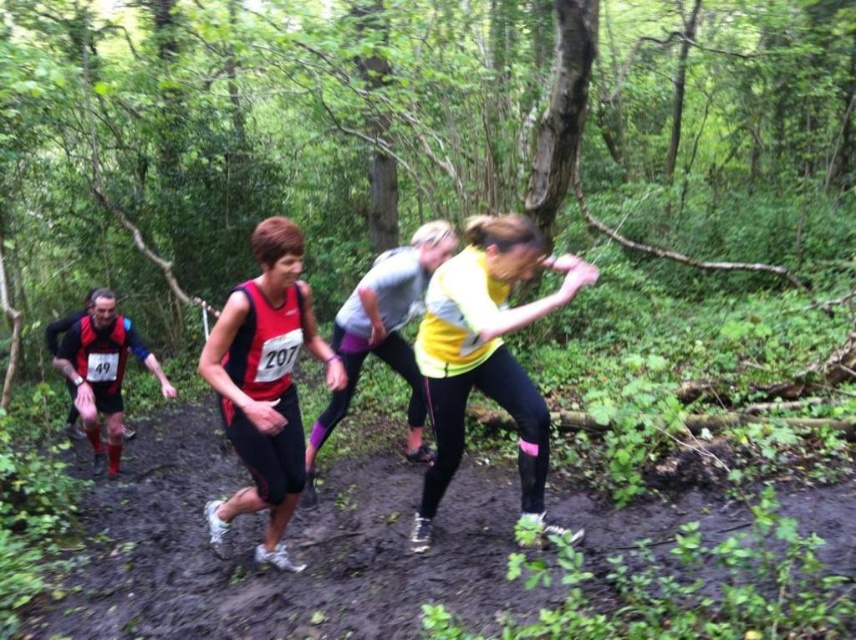
Can you confirm if yellow fabric running suit at center is positioned to the right of matte black running suit at left?

Indeed, yellow fabric running suit at center is positioned on the right side of matte black running suit at left.

Which is more to the left, yellow fabric running suit at center or matte black running suit at left?

matte black running suit at left is more to the left.

Is point (354, 298) farther from camera compared to point (78, 362)?

No, it is not.

Locate an element on the screen. The image size is (856, 640). yellow fabric running suit at center is located at coordinates (383, 333).

Which of these two, matte red tank top at center or matte black running suit at left, stands taller?

Standing taller between the two is matte red tank top at center.

Looking at this image, is the position of matte red tank top at center less distant than that of matte black running suit at left?

Yes.

What do you see at coordinates (265, 385) in the screenshot? The image size is (856, 640). I see `matte red tank top at center` at bounding box center [265, 385].

Find the location of `matte red tank top at center`. matte red tank top at center is located at coordinates (265, 385).

Can you confirm if matte red tank top at center is positioned to the left of yellow fabric running suit at center?

Indeed, matte red tank top at center is positioned on the left side of yellow fabric running suit at center.

Find the location of `matte red tank top at center`. matte red tank top at center is located at coordinates (265, 385).

You are a GUI agent. You are given a task and a screenshot of the screen. Output one action in this format:
    pyautogui.click(x=<x>, y=<y>)
    Task: Click on the matte red tank top at center
    The height and width of the screenshot is (640, 856).
    Given the screenshot: What is the action you would take?
    pyautogui.click(x=265, y=385)